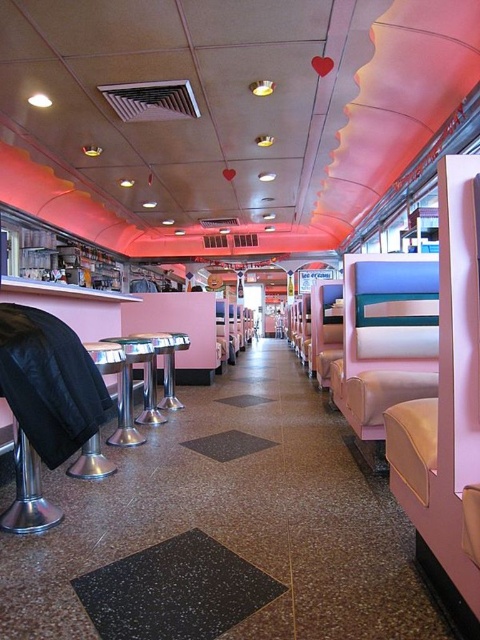
You are standing in the diner and see two points marked on the floor. The first point is at coordinate point (132, 401) and the second is at point (79, 476). Which point is closer to you?

Point (132, 401) is further to the viewer than point (79, 476), so the second point is closer to you.

You are standing in the diner and want to reach the point marked at coordinates (x=103, y=458). Given that the average walking distance for an adult is about 2 meters, can you comfortably reach this point without moving any furniture?

The point at coordinates (x=103, y=458) is 2.87 meters away from the camera. Since the average walking distance for an adult is about 2 meters, reaching this point would require moving beyond the typical comfortable range without rearranging furniture.

You are a customer entering the diner and want to sit at the metallic silver table at lower left. Based on its location, can you estimate whether it is closer to the entrance or the booths along the right side?

The metallic silver table at lower left is located at point (92, 461), which suggests it is closer to the entrance than the booths along the right side.